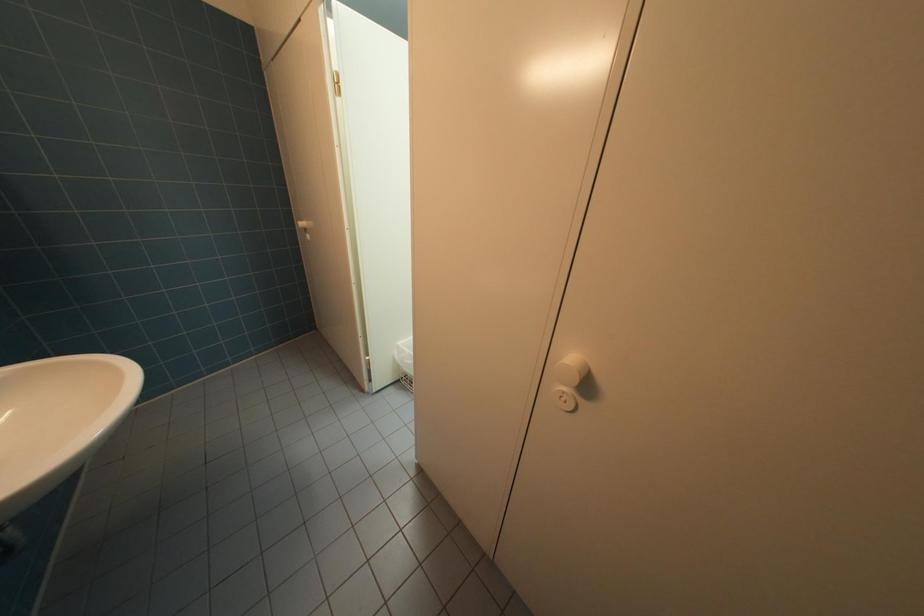
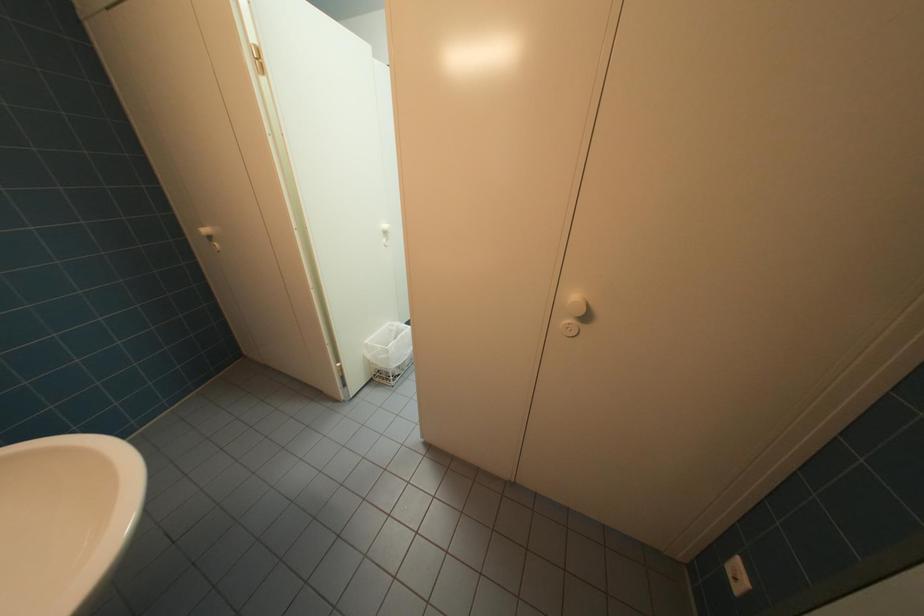
Question: Which direction would the cameraman need to move to produce the second image? Reply with the corresponding letter.

Choices:
 (A) Left
 (B) Right
 (C) Forward
 (D) Backward

Answer: (A)